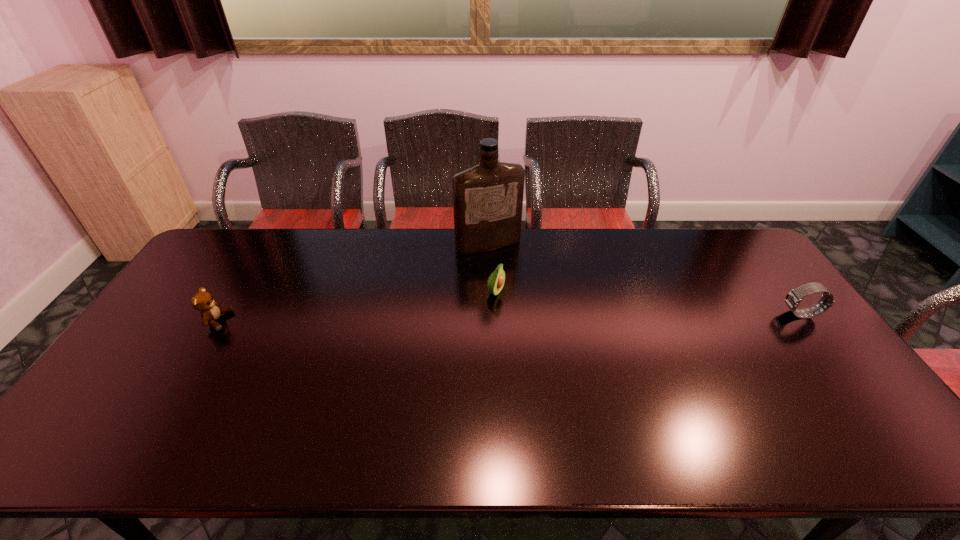
Identify the location of free space on the desktop that is between the leftmost object and the watch and is positioned on the label side of the farthest object. The height and width of the screenshot is (540, 960). (532, 317).

Identify the location of free spot on the desktop that is between the teddy bear and the rightmost object and is positioned on the cut side of the second farthest object. The height and width of the screenshot is (540, 960). (556, 317).